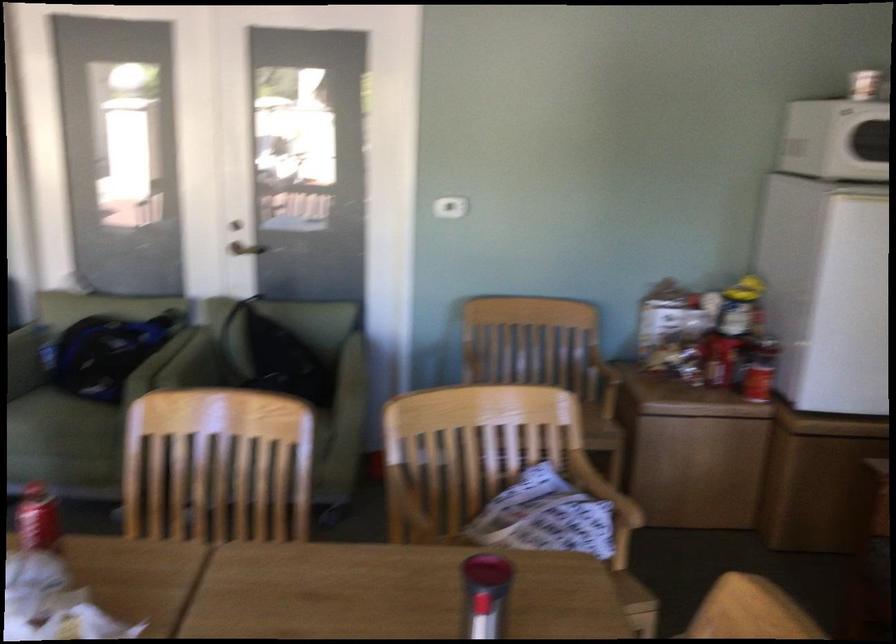
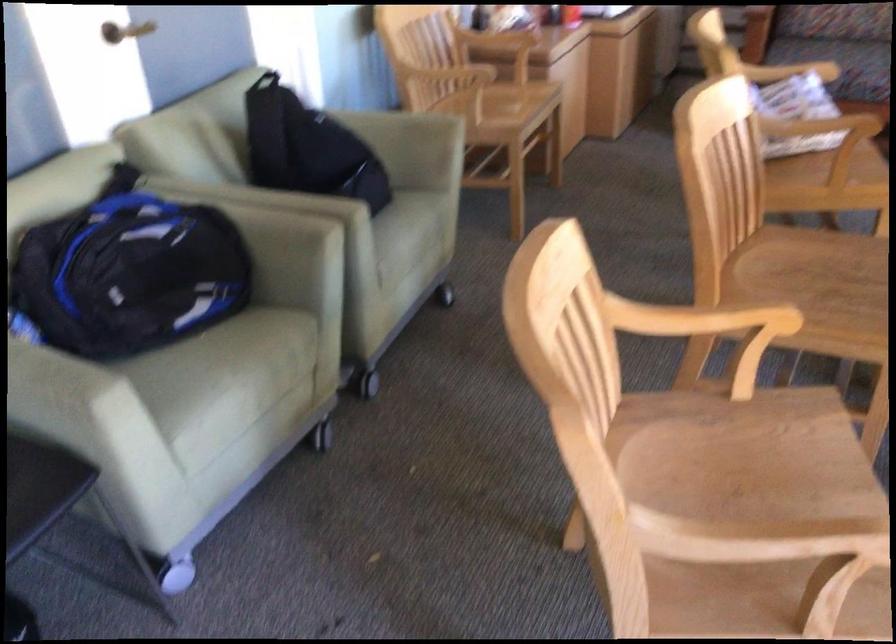
Locate, in the second image, the point that corresponds to point 248,247 in the first image.

(125, 31)